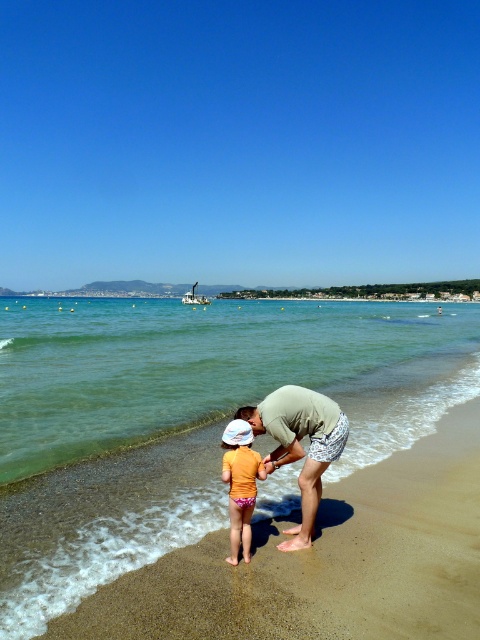
You are standing on the beach and want to find the clear blue water at lower center. According to the coordinates provided, where should you look relative to your position?

The clear blue water at lower center is located at point coordinates of 0.578 on the x axis and 0.452 on the y axis relative to the image frame.

You are a parent trying to ensure your child stays within a safe distance. You see the light green fabric at center and the orange fabric toddler at center. Based on the distance between them, can you confirm if the toddler is within the recommended 16 inches safety zone?

The distance between the light green fabric at center and the orange fabric toddler at center is 14.59 inches, which is within the recommended 16 inches safety zone.

You are a lifeguard on duty at the beach. You notice a swimmer in distress at the location marked by point (300,444). Based on the scene description, what is the nearest object to the distressed swimmer?

The nearest object to the distressed swimmer at point (300,444) is the light green fabric at center, which is marked by the point itself.